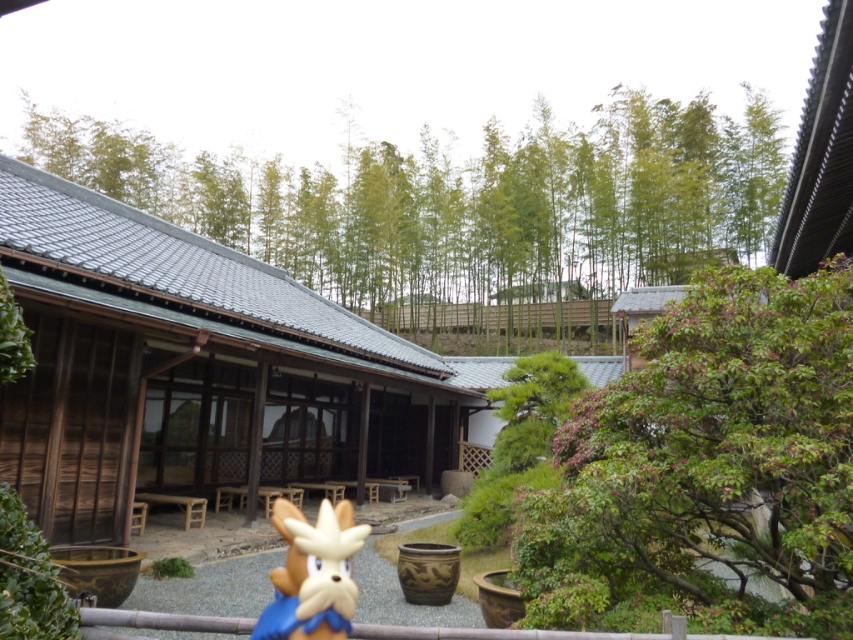
Question: Which point is closer to the camera taking this photo?

Choices:
 (A) (310, 600)
 (B) (111, 616)

Answer: (A)

Question: In this image, where is brown plush toy at center located relative to brown wooden rail at lower center?

Choices:
 (A) left
 (B) right

Answer: (A)

Question: Does brown plush toy at center appear on the left side of brown wooden rail at lower center?

Choices:
 (A) yes
 (B) no

Answer: (A)

Question: Considering the relative positions of brown plush toy at center and brown wooden rail at lower center in the image provided, where is brown plush toy at center located with respect to brown wooden rail at lower center?

Choices:
 (A) right
 (B) left

Answer: (B)